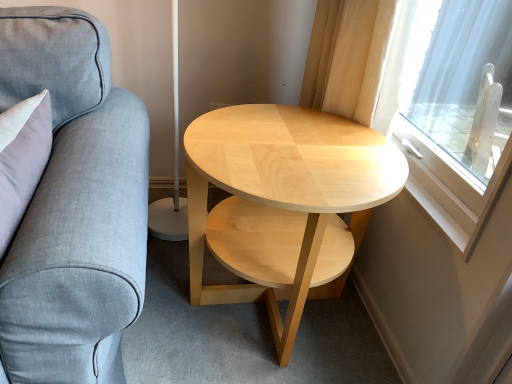
What do you see at coordinates (415, 101) in the screenshot?
I see `transparent glass window at right` at bounding box center [415, 101].

The image size is (512, 384). What are the coordinates of `transparent glass window at right` in the screenshot? It's located at (415, 101).

The width and height of the screenshot is (512, 384). Identify the location of gray fabric couch at left. (74, 205).

Where is `transparent glass window at right`? transparent glass window at right is located at coordinates (415, 101).

In order to click on coffee table that appears below the gray fabric couch at left (from a real-world perspective) in this screenshot , I will do `click(285, 190)`.

Does natural wood coffee table at center come in front of gray fabric couch at left?

No.

From a real-world perspective, which object stands above the other?

gray fabric couch at left.

Choose the correct answer: Is natural wood coffee table at center inside gray fabric couch at left or outside it?

natural wood coffee table at center is outside gray fabric couch at left.

Based on their sizes in the image, would you say transparent glass window at right is bigger or smaller than gray fabric couch at left?

transparent glass window at right is smaller than gray fabric couch at left.

Is transparent glass window at right oriented away from gray fabric couch at left?

No, transparent glass window at right's orientation is not away from gray fabric couch at left.

Consider the image. Between transparent glass window at right and gray fabric couch at left, which one is positioned in front?

Positioned in front is gray fabric couch at left.

Is transparent glass window at right wider than gray fabric couch at left?

In fact, transparent glass window at right might be narrower than gray fabric couch at left.

Are gray fabric couch at left and natural wood coffee table at center far apart?

No, gray fabric couch at left is not far from natural wood coffee table at center.

Find the location of `coffee table located on the right of gray fabric couch at left`. coffee table located on the right of gray fabric couch at left is located at coordinates (285, 190).

Who is smaller, gray fabric couch at left or natural wood coffee table at center?

gray fabric couch at left is smaller.

From the image's perspective, is gray fabric couch at left located above or below natural wood coffee table at center?

gray fabric couch at left is situated lower than natural wood coffee table at center in the image.

Is natural wood coffee table at center turned away from transparent glass window at right?

No, natural wood coffee table at center's orientation is not away from transparent glass window at right.

Which object is closer to the camera taking this photo, natural wood coffee table at center or transparent glass window at right?

Positioned in front is transparent glass window at right.

This screenshot has height=384, width=512. Identify the location of window lying on the right of natural wood coffee table at center. (415, 101).

From the picture: Can you confirm if gray fabric couch at left is smaller than transparent glass window at right?

Incorrect, gray fabric couch at left is not smaller in size than transparent glass window at right.

Considering their positions, is gray fabric couch at left located in front of or behind transparent glass window at right?

In the image, gray fabric couch at left appears in front of transparent glass window at right.

In the scene shown: Which is correct: gray fabric couch at left is inside transparent glass window at right, or outside of it?

gray fabric couch at left cannot be found inside transparent glass window at right.

How distant is transparent glass window at right from natural wood coffee table at center?

transparent glass window at right is 30.87 centimeters from natural wood coffee table at center.

From the image's perspective, who appears lower, transparent glass window at right or natural wood coffee table at center?

From the image's view, natural wood coffee table at center is below.

Between point (386, 118) and point (358, 216), which one is positioned behind?

The point (358, 216) is more distant.

Would you consider transparent glass window at right to be distant from natural wood coffee table at center?

No, transparent glass window at right is in close proximity to natural wood coffee table at center.

Where is `studio couch positioned vertically above the natural wood coffee table at center (from a real-world perspective)`? The image size is (512, 384). studio couch positioned vertically above the natural wood coffee table at center (from a real-world perspective) is located at coordinates (74, 205).

Where is `studio couch below the transparent glass window at right (from a real-world perspective)`? studio couch below the transparent glass window at right (from a real-world perspective) is located at coordinates (74, 205).

When comparing their distances from transparent glass window at right, does natural wood coffee table at center or gray fabric couch at left seem further?

The object further to transparent glass window at right is gray fabric couch at left.

From the image, which object appears to be farther from gray fabric couch at left, transparent glass window at right or natural wood coffee table at center?

transparent glass window at right is further to gray fabric couch at left.

When comparing their distances from transparent glass window at right, does gray fabric couch at left or natural wood coffee table at center seem further?

Based on the image, gray fabric couch at left appears to be further to transparent glass window at right.

Estimate the real-world distances between objects in this image. Which object is further from natural wood coffee table at center, transparent glass window at right or gray fabric couch at left?

The object further to natural wood coffee table at center is gray fabric couch at left.

Consider the image. Considering their positions, is natural wood coffee table at center positioned closer to gray fabric couch at left than transparent glass window at right?

natural wood coffee table at center.

Which object lies nearer to the anchor point natural wood coffee table at center, gray fabric couch at left or transparent glass window at right?

Among the two, transparent glass window at right is located nearer to natural wood coffee table at center.

The image size is (512, 384). I want to click on coffee table between gray fabric couch at left and transparent glass window at right from left to right, so click(285, 190).